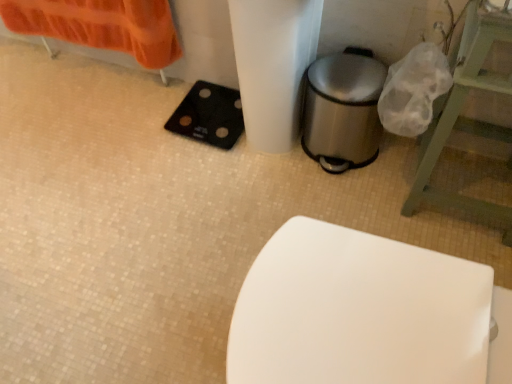
Question: From a real-world perspective, relative to green wooden stool at right, is black rubber scale at lower left vertically above or below?

Choices:
 (A) above
 (B) below

Answer: (B)

Question: In the image, is black rubber scale at lower left on the left side or the right side of green wooden stool at right?

Choices:
 (A) left
 (B) right

Answer: (A)

Question: Which of these objects is positioned closest to the green wooden stool at right?

Choices:
 (A) black rubber scale at lower left
 (B) polished stainless steel trash can at lower right

Answer: (B)

Question: Which object is the closest to the black rubber scale at lower left?

Choices:
 (A) green wooden stool at right
 (B) polished stainless steel trash can at lower right

Answer: (B)